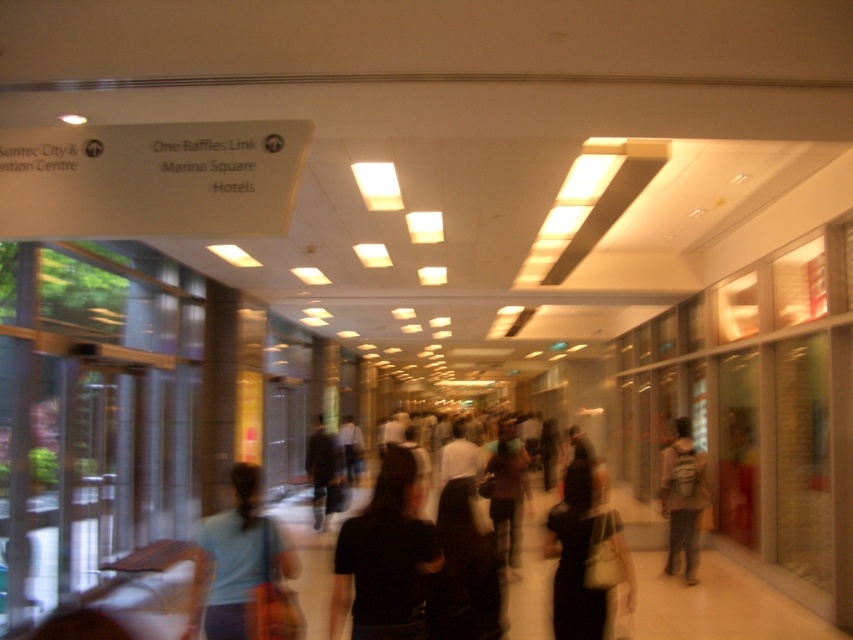
Does light blue fabric shirt at center have a larger size compared to dark clothing at center?

No.

Does light blue fabric shirt at center lie behind dark clothing at center?

No.

Is point (242, 596) farther from viewer compared to point (325, 436)?

No, it is in front of (325, 436).

You are a GUI agent. You are given a task and a screenshot of the screen. Output one action in this format:
    pyautogui.click(x=<x>, y=<y>)
    Task: Click on the light blue fabric shirt at center
    Image resolution: width=853 pixels, height=640 pixels.
    Given the screenshot: What is the action you would take?
    pyautogui.click(x=242, y=556)

Who is positioned more to the right, black matte shirt at center or dark clothing at center?

black matte shirt at center is more to the right.

Between black matte shirt at center and dark clothing at center, which one is positioned higher?

black matte shirt at center

What are the coordinates of `black matte shirt at center` in the screenshot? It's located at (386, 556).

Can you confirm if light blue fabric shirt at center is bigger than light brown backpack at center?

No, light blue fabric shirt at center is not bigger than light brown backpack at center.

This screenshot has height=640, width=853. Describe the element at coordinates (242, 556) in the screenshot. I see `light blue fabric shirt at center` at that location.

Does point (223, 556) come in front of point (680, 538)?

Yes.

In order to click on light blue fabric shirt at center in this screenshot , I will do `click(242, 556)`.